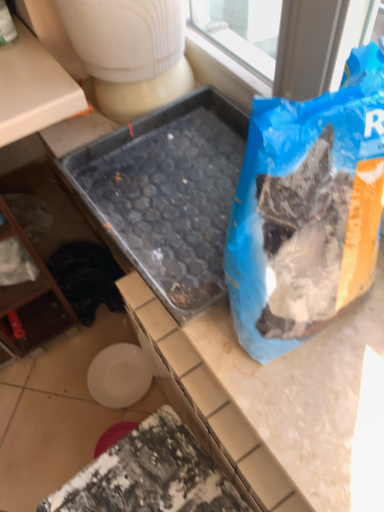
Locate an element on the screen. The height and width of the screenshot is (512, 384). blank space to the left of blue plastic bag at upper right is located at coordinates (175, 262).